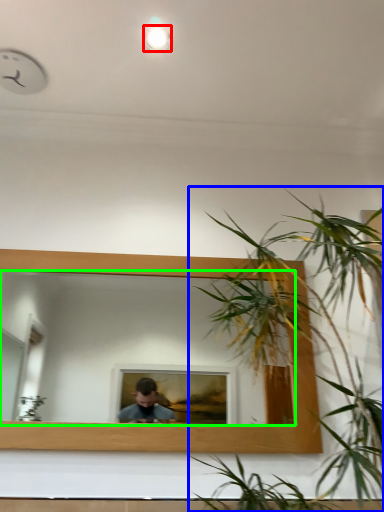
Question: Considering the real-world distances, which object is farthest from light (highlighted by a red box)? houseplant (highlighted by a blue box) or mirror (highlighted by a green box)?

Choices:
 (A) houseplant
 (B) mirror

Answer: (B)